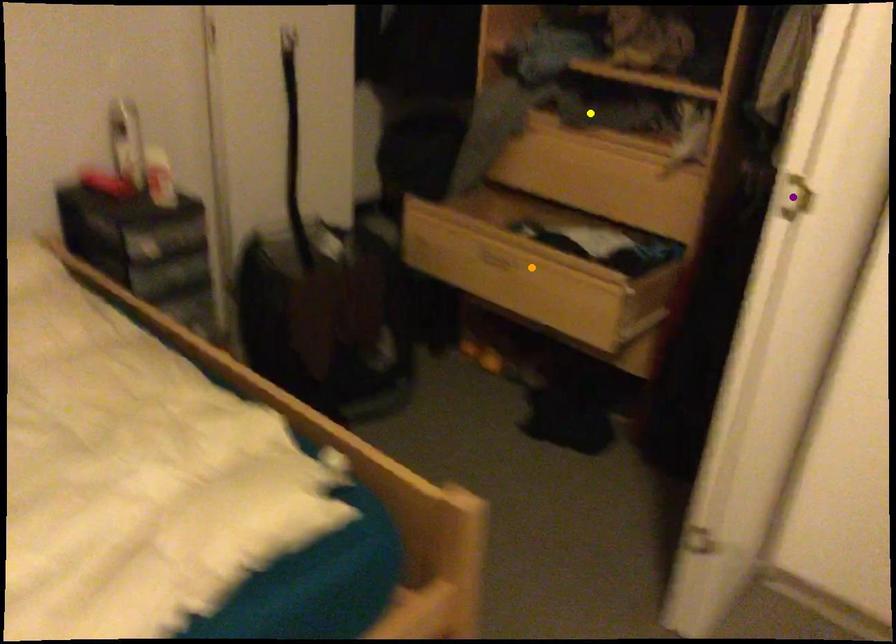
Order these from farthest to nearest:
1. yellow point
2. purple point
3. orange point

yellow point
orange point
purple point